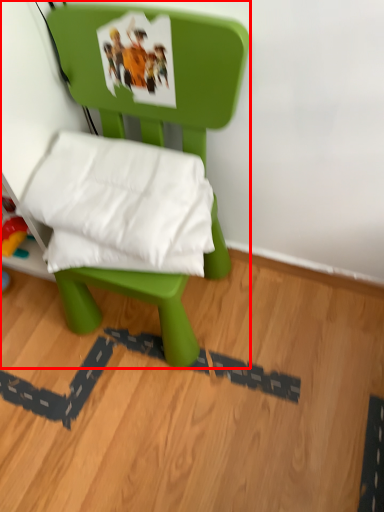
Question: Considering the relative positions of furniture (annotated by the red box) and pillow in the image provided, where is furniture (annotated by the red box) located with respect to the staircase?

Choices:
 (A) right
 (B) left

Answer: (A)